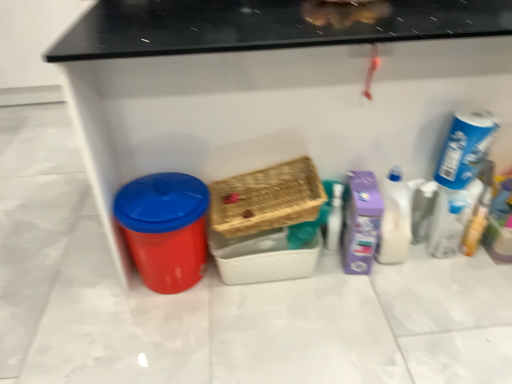
Question: Does woven wood basket at center, the first basket in the bottom-to-top sequence, have a greater width compared to blue cardboard box at upper right, the 1th cleaning product viewed from the right?

Choices:
 (A) no
 (B) yes

Answer: (B)

Question: Could you tell me if woven wood basket at center, the first basket in the bottom-to-top sequence, is turned towards blue cardboard box at upper right, which is the 3th cleaning product in left-to-right order?

Choices:
 (A) no
 (B) yes

Answer: (A)

Question: Would you consider woven wood basket at center, the first basket in the bottom-to-top sequence, to be distant from blue cardboard box at upper right, which is the 3th cleaning product in left-to-right order?

Choices:
 (A) no
 (B) yes

Answer: (A)

Question: From a real-world perspective, is woven wood basket at center, the first basket in the bottom-to-top sequence, positioned under blue cardboard box at upper right, which is the 3th cleaning product in left-to-right order, based on gravity?

Choices:
 (A) yes
 (B) no

Answer: (A)

Question: Can you confirm if woven wood basket at center, the first basket in the bottom-to-top sequence, is positioned to the right of blue cardboard box at upper right, the 1th cleaning product viewed from the right?

Choices:
 (A) no
 (B) yes

Answer: (A)

Question: Based on their positions, is purple cardboard box at right, which is the first cleaning product from left to right, located to the left or right of woven wood basket at center, the first basket in the bottom-to-top sequence?

Choices:
 (A) right
 (B) left

Answer: (A)

Question: From their relative heights in the image, would you say purple cardboard box at right, which is the first cleaning product from left to right, is taller or shorter than woven wood basket at center, the first basket in the bottom-to-top sequence?

Choices:
 (A) short
 (B) tall

Answer: (B)

Question: From the image's perspective, relative to woven wood basket at center, arranged as the second basket when viewed from the top, is purple cardboard box at right, acting as the third cleaning product starting from the right, above or below?

Choices:
 (A) below
 (B) above

Answer: (B)

Question: Do you think purple cardboard box at right, which is the first cleaning product from left to right, is within woven wood basket at center, arranged as the second basket when viewed from the top, or outside of it?

Choices:
 (A) outside
 (B) inside

Answer: (A)

Question: Visually, is white glossy bottle at right, the 2th cleaning product in the left-to-right sequence, positioned to the left or to the right of purple cardboard box at right, which is the first cleaning product from left to right?

Choices:
 (A) left
 (B) right

Answer: (B)

Question: In terms of size, does white glossy bottle at right, the 2th cleaning product in the left-to-right sequence, appear bigger or smaller than purple cardboard box at right, acting as the third cleaning product starting from the right?

Choices:
 (A) small
 (B) big

Answer: (A)

Question: In terms of width, does white glossy bottle at right, the 2th cleaning product in the left-to-right sequence, look wider or thinner when compared to purple cardboard box at right, acting as the third cleaning product starting from the right?

Choices:
 (A) thin
 (B) wide

Answer: (A)

Question: From a real-world perspective, is white glossy bottle at right, the 2th cleaning product viewed from the right, physically located above or below purple cardboard box at right, which is the first cleaning product from left to right?

Choices:
 (A) above
 (B) below

Answer: (A)

Question: Would you say woven brown basket at center, which appears as the first basket when viewed from the top, is inside or outside white glossy bottle at right, the 2th cleaning product in the left-to-right sequence?

Choices:
 (A) inside
 (B) outside

Answer: (B)

Question: From a real-world perspective, relative to white glossy bottle at right, the 2th cleaning product viewed from the right, is woven brown basket at center, the 2th basket when ordered from bottom to top, vertically above or below?

Choices:
 (A) above
 (B) below

Answer: (A)